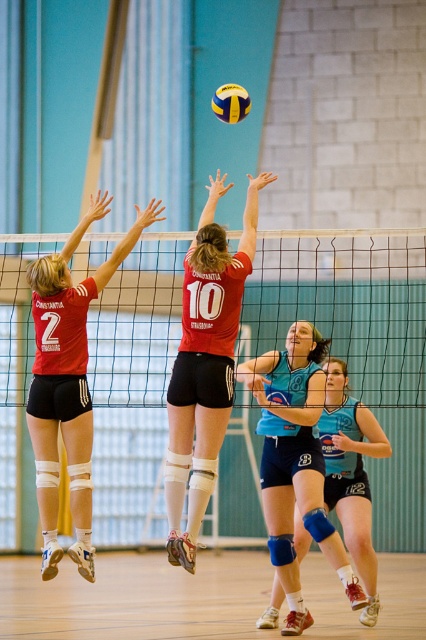
Question: Among these objects, which one is farthest from the camera?

Choices:
 (A) matte black shorts at upper left
 (B) yellow matte/vinyl volleyball at center
 (C) teal jersey at center

Answer: (C)

Question: Which point appears closest to the camera in this image?

Choices:
 (A) (258, 342)
 (B) (227, 394)
 (C) (313, 451)

Answer: (B)

Question: Is teal jersey at center smaller than yellow matte/vinyl volleyball at center?

Choices:
 (A) yes
 (B) no

Answer: (B)

Question: Does white mesh net at center have a larger size compared to matte red shorts at center?

Choices:
 (A) yes
 (B) no

Answer: (A)

Question: Which of the following is the closest to the observer?

Choices:
 (A) matte black shorts at upper left
 (B) teal jersey at center
 (C) yellow matte/vinyl volleyball at center

Answer: (A)

Question: Is matte black shorts at upper left thinner than yellow matte/vinyl volleyball at center?

Choices:
 (A) no
 (B) yes

Answer: (A)